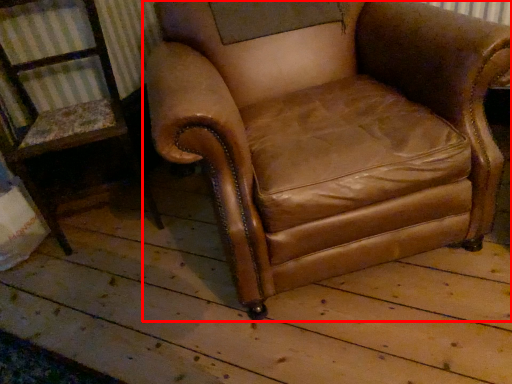
Question: From the image's perspective, considering the relative positions of chair (annotated by the red box) and chair in the image provided, where is chair (annotated by the red box) located with respect to the staircase?

Choices:
 (A) below
 (B) above

Answer: (B)